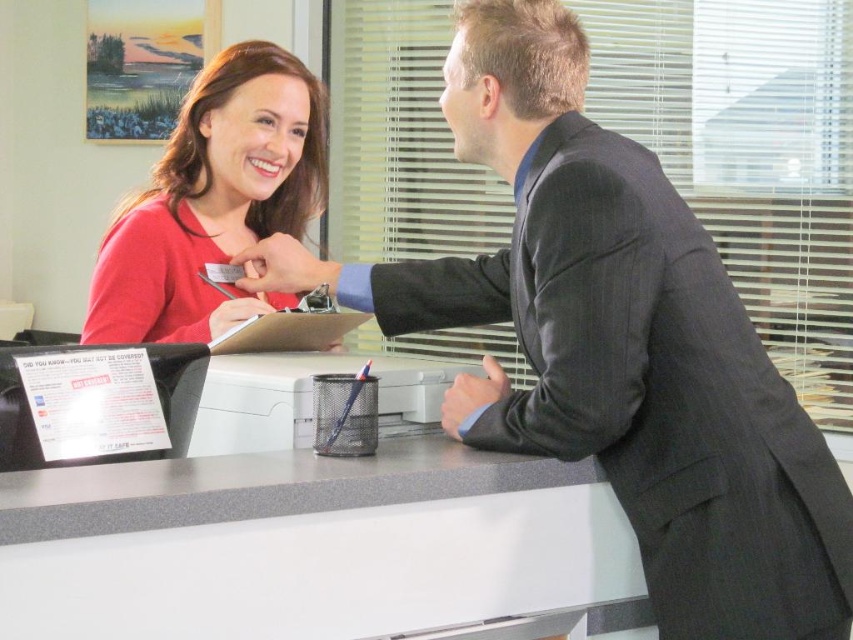
You are a delivery person who needs to place a package on the desk. The package is 50 centimeters long. Can you fit it on the white laminate table at center without overlapping the matte black pen at center?

The white laminate table at center and matte black pen at center are 54.45 centimeters apart from each other. Since the package is only 50 centimeters long, it can be placed between them without overlapping the pen.

You are standing at the reception desk and want to place a small object on the desk. There are two points marked on the desk at coordinates point (262, 109) and point (254, 298). Which point is closer to you, the viewer?

Point (262, 109) is closer to you because it is further to the viewer than point (254, 298).

You are standing at the reception desk and need to place a small object on the nearest point between point (581,496) and point (207,323). Which point should you choose?

You should place the object on point (581,496) because it is closer to you than point (207,323).